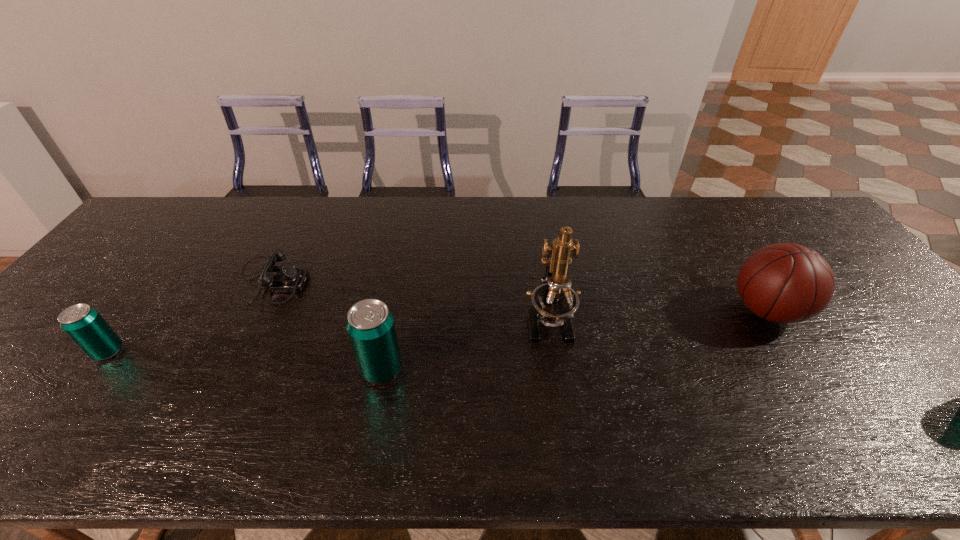
Find the location of a particular element. free space located on the right of the taller beer can is located at coordinates (445, 369).

You are a GUI agent. You are given a task and a screenshot of the screen. Output one action in this format:
    pyautogui.click(x=<x>, y=<y>)
    Task: Click on the free region located on the left of the basketball
    This screenshot has width=960, height=540.
    Given the screenshot: What is the action you would take?
    pyautogui.click(x=687, y=310)

At what (x,y) coordinates should I click in order to perform the action: click on free region located on the front-facing side of the fourth object from right to left. Please return your answer as a coordinate pair (x, y). Looking at the image, I should click on (406, 281).

Where is `vacant space positioned 0.140m at the eyepiece of the fourth object from left to right`? This screenshot has height=540, width=960. vacant space positioned 0.140m at the eyepiece of the fourth object from left to right is located at coordinates (561, 402).

Identify the location of object that is positioned at the near edge. (370, 325).

The image size is (960, 540). I want to click on free space at the far edge, so click(260, 217).

Identify the location of free space at the near edge of the desktop. (615, 395).

I want to click on free space at the left edge, so click(x=39, y=356).

Find the location of a particular element. This screenshot has height=540, width=960. vacant space at the right edge of the desktop is located at coordinates [816, 243].

You are a GUI agent. You are given a task and a screenshot of the screen. Output one action in this format:
    pyautogui.click(x=<x>, y=<y>)
    Task: Click on the free space at the near right corner of the desktop
    The width and height of the screenshot is (960, 540).
    Given the screenshot: What is the action you would take?
    pyautogui.click(x=950, y=407)